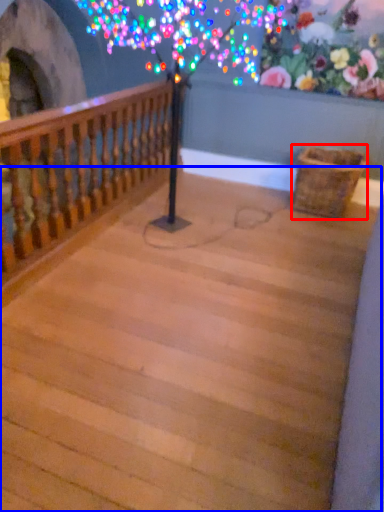
Question: Which object is further to the camera taking this photo, basket (highlighted by a red box) or stairwell (highlighted by a blue box)?

Choices:
 (A) basket
 (B) stairwell

Answer: (A)